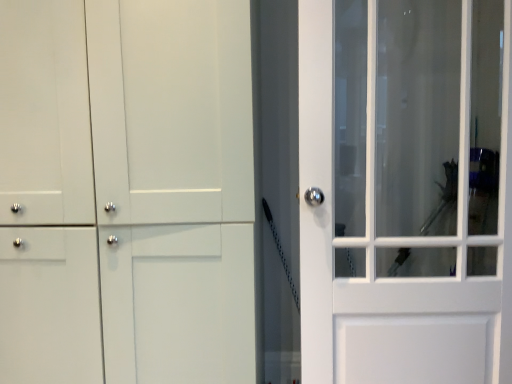
Question: In the image, is white glass door at right on the left side or the right side of white matte cabinet at left?

Choices:
 (A) right
 (B) left

Answer: (A)

Question: Considering the positions of white glass door at right and white matte cabinet at left in the image, is white glass door at right taller or shorter than white matte cabinet at left?

Choices:
 (A) tall
 (B) short

Answer: (B)

Question: Is white glass door at right situated inside white matte cabinet at left or outside?

Choices:
 (A) outside
 (B) inside

Answer: (A)

Question: Do you think white matte cabinet at left is within white glass door at right, or outside of it?

Choices:
 (A) outside
 (B) inside

Answer: (A)

Question: From a real-world perspective, is white matte cabinet at left positioned above or below white glass door at right?

Choices:
 (A) above
 (B) below

Answer: (B)

Question: Considering their positions, is white matte cabinet at left located in front of or behind white glass door at right?

Choices:
 (A) behind
 (B) front

Answer: (B)

Question: From the image's perspective, is white matte cabinet at left positioned above or below white glass door at right?

Choices:
 (A) above
 (B) below

Answer: (B)